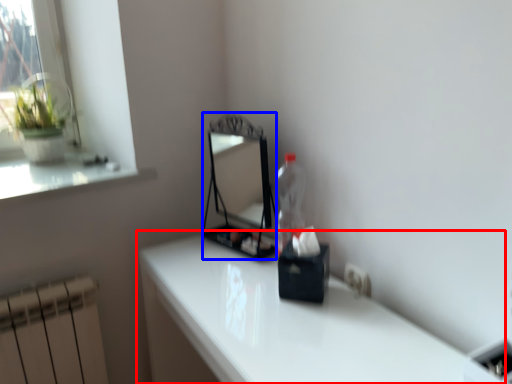
Question: Among these objects, which one is farthest to the camera, table (highlighted by a red box) or mirror (highlighted by a blue box)?

Choices:
 (A) table
 (B) mirror

Answer: (B)